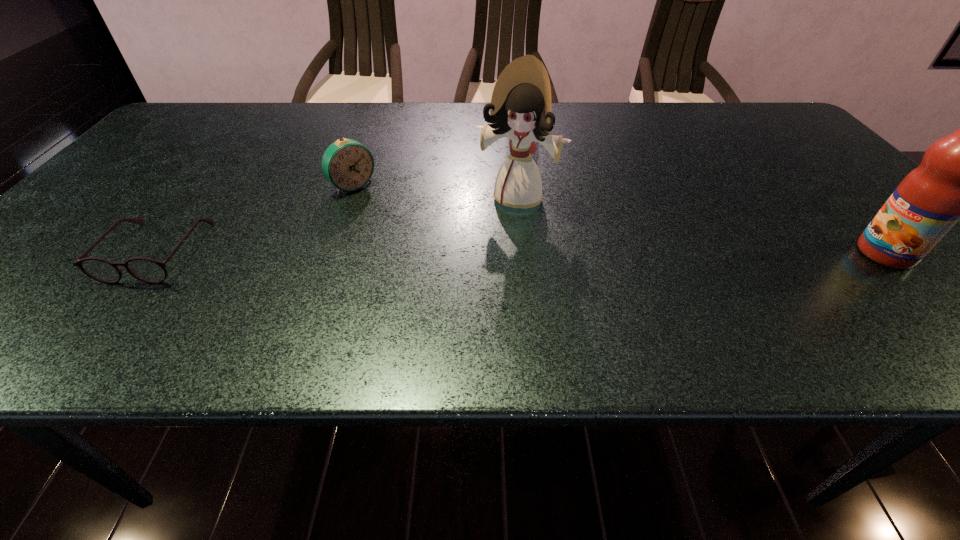
At what (x,y) coordinates should I click in order to perform the action: click on the shortest object. Please return your answer as a coordinate pair (x, y). The height and width of the screenshot is (540, 960). Looking at the image, I should click on (147, 270).

Locate an element on the screen. The image size is (960, 540). spectacles is located at coordinates (147, 270).

Identify the location of fruit juice. This screenshot has height=540, width=960. (959, 177).

Identify the location of the third object from right to left. (347, 164).

This screenshot has height=540, width=960. In order to click on alarm clock in this screenshot , I will do `click(347, 164)`.

The height and width of the screenshot is (540, 960). I want to click on doll, so click(520, 108).

This screenshot has width=960, height=540. In order to click on vacant region located on the front label of the rightmost object in this screenshot , I will do `click(714, 253)`.

You are a GUI agent. You are given a task and a screenshot of the screen. Output one action in this format:
    pyautogui.click(x=<x>, y=<y>)
    Task: Click on the free location located 0.160m on the front label of the rightmost object
    
    Given the screenshot: What is the action you would take?
    pyautogui.click(x=782, y=253)

Locate an element on the screen. vacant region located 0.120m on the front label of the rightmost object is located at coordinates (802, 253).

Where is `free space located on the front-facing side of the second shortest object`? free space located on the front-facing side of the second shortest object is located at coordinates (422, 247).